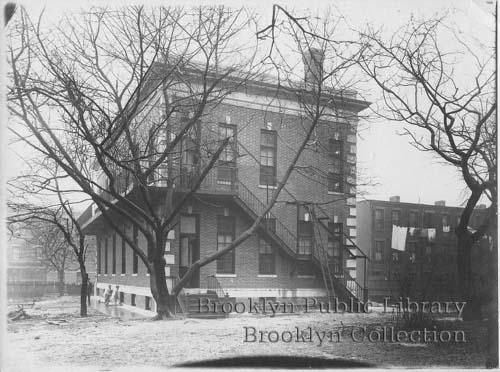
At what (x,y) coordinates should I click in order to perform the action: click on stairway. Please return your answer as a coordinate pair (x, y). This screenshot has height=372, width=500. Looking at the image, I should click on (354, 291).